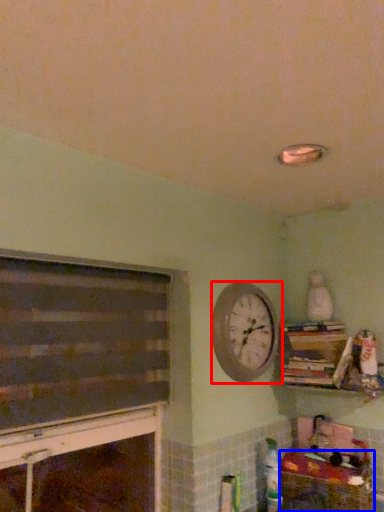
Question: Among these objects, which one is farthest to the camera, wall clock (highlighted by a red box) or crate (highlighted by a blue box)?

Choices:
 (A) wall clock
 (B) crate

Answer: (A)